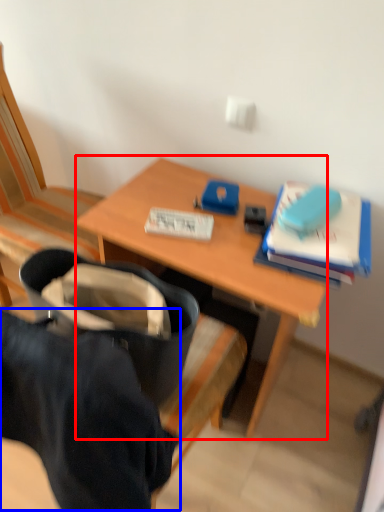
Question: Which of the following is the closest to the observer, desk (highlighted by a red box) or clothing (highlighted by a blue box)?

Choices:
 (A) desk
 (B) clothing

Answer: (B)